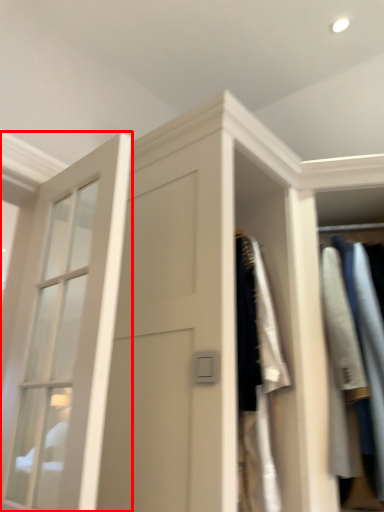
Question: From the image's perspective, where is window (annotated by the red box) located in relation to clothing in the image?

Choices:
 (A) below
 (B) above

Answer: (B)